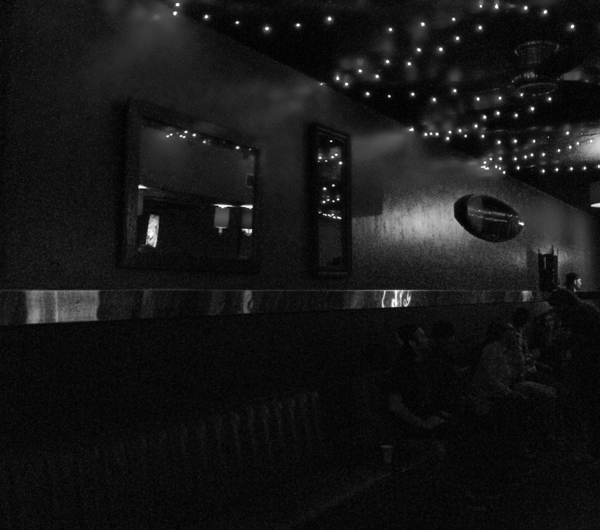
Locate an element on the screen. mirror or sign is located at coordinates (482, 228).